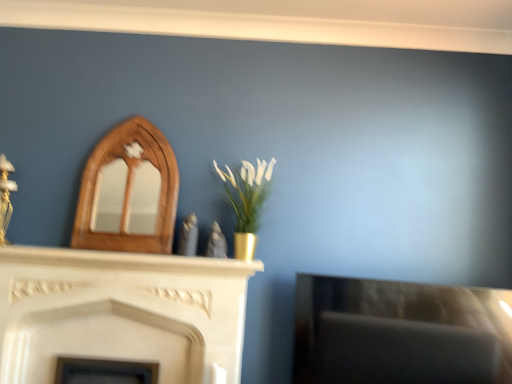
Question: From the image's perspective, does white marble mantle at center appear lower than wooden mirror at upper left, placed as the 2th fireplace when sorted from bottom to top?

Choices:
 (A) yes
 (B) no

Answer: (A)

Question: Can you confirm if white marble mantle at center is shorter than wooden mirror at upper left, which is the first fireplace in top-to-bottom order?

Choices:
 (A) no
 (B) yes

Answer: (B)

Question: From a real-world perspective, is white marble mantle at center positioned over wooden mirror at upper left, which is the first fireplace in top-to-bottom order, based on gravity?

Choices:
 (A) no
 (B) yes

Answer: (A)

Question: Is white marble mantle at center wider than wooden mirror at upper left, which is the first fireplace in top-to-bottom order?

Choices:
 (A) yes
 (B) no

Answer: (A)

Question: Does white marble mantle at center have a larger size compared to wooden mirror at upper left, placed as the 2th fireplace when sorted from bottom to top?

Choices:
 (A) yes
 (B) no

Answer: (B)

Question: Does white marble mantle at center touch wooden mirror at upper left, placed as the 2th fireplace when sorted from bottom to top?

Choices:
 (A) yes
 (B) no

Answer: (B)

Question: From the image's perspective, is white marble fireplace at center, the 2th fireplace positioned from the top, on gold metallic vase at center?

Choices:
 (A) no
 (B) yes

Answer: (A)

Question: Is white marble fireplace at center, which ranks as the first fireplace in bottom-to-top order, facing towards gold metallic vase at center?

Choices:
 (A) no
 (B) yes

Answer: (A)

Question: From a real-world perspective, does white marble fireplace at center, which ranks as the first fireplace in bottom-to-top order, sit lower than gold metallic vase at center?

Choices:
 (A) yes
 (B) no

Answer: (A)

Question: Does white marble fireplace at center, which ranks as the first fireplace in bottom-to-top order, have a lesser height compared to gold metallic vase at center?

Choices:
 (A) yes
 (B) no

Answer: (B)

Question: Would you say gold metallic vase at center is part of white marble fireplace at center, the 2th fireplace positioned from the top,'s contents?

Choices:
 (A) yes
 (B) no

Answer: (B)

Question: Is white marble fireplace at center, the 2th fireplace positioned from the top, bigger than gold metallic vase at center?

Choices:
 (A) yes
 (B) no

Answer: (A)

Question: Considering the relative sizes of gold metallic vase at center and white marble mantle at center in the image provided, is gold metallic vase at center wider than white marble mantle at center?

Choices:
 (A) no
 (B) yes

Answer: (A)